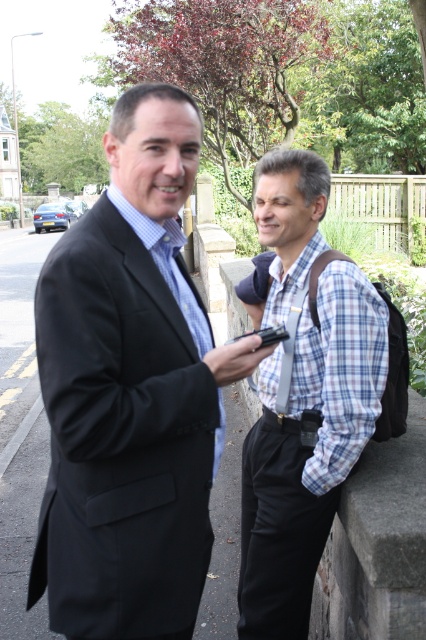
Question: Which of the following is the farthest from the observer?

Choices:
 (A) plaid fabric shirt at center
 (B) black suit at left

Answer: (A)

Question: Is black suit at left to the left of plaid fabric shirt at center from the viewer's perspective?

Choices:
 (A) no
 (B) yes

Answer: (B)

Question: Considering the relative positions of black suit at left and plaid fabric shirt at center in the image provided, where is black suit at left located with respect to plaid fabric shirt at center?

Choices:
 (A) below
 (B) above

Answer: (B)

Question: Is black suit at left above plaid fabric shirt at center?

Choices:
 (A) yes
 (B) no

Answer: (A)

Question: Which point is closer to the camera?

Choices:
 (A) (181, 568)
 (B) (305, 344)

Answer: (A)